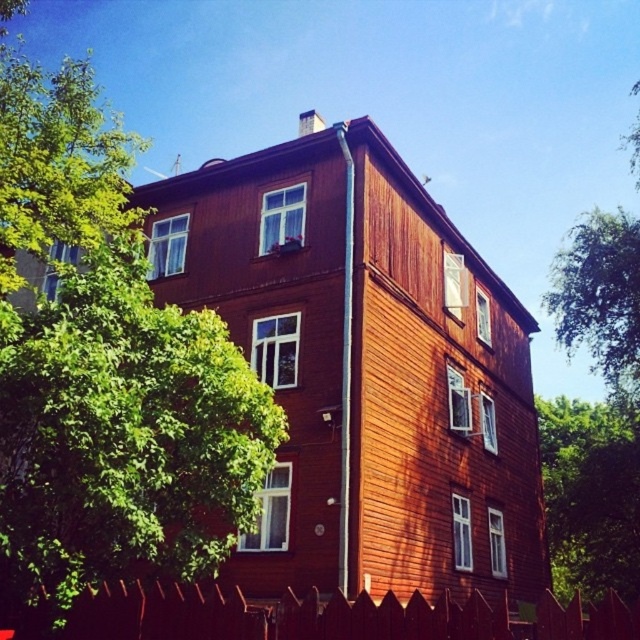
You are standing in front of the three story residential building and want to walk towards the green leafy tree at center. Which direction should you move relative to the smooth wooden fence at lower center?

You should move to the right side of the smooth wooden fence at lower center to reach the green leafy tree at center since the smooth wooden fence at lower center is on the left side of the green leafy tree at center.

You are standing in front of the residential building and want to take a photo. You notice two points marked on the building. The first point is at coordinates point [72,113] and the second is at point [355,598]. Which point is closer to your camera?

Point [72,113] is further to the camera than point [355,598], so the second point is closer to the camera.

You are standing at the point where the red picket fence runs along the bottom edge. Which direction should you walk to reach the smooth wooden fence at lower center?

The smooth wooden fence at lower center is located at point (330, 616). Since you are at the red picket fence along the bottom edge, you should walk towards the center to reach the smooth wooden fence at lower center.